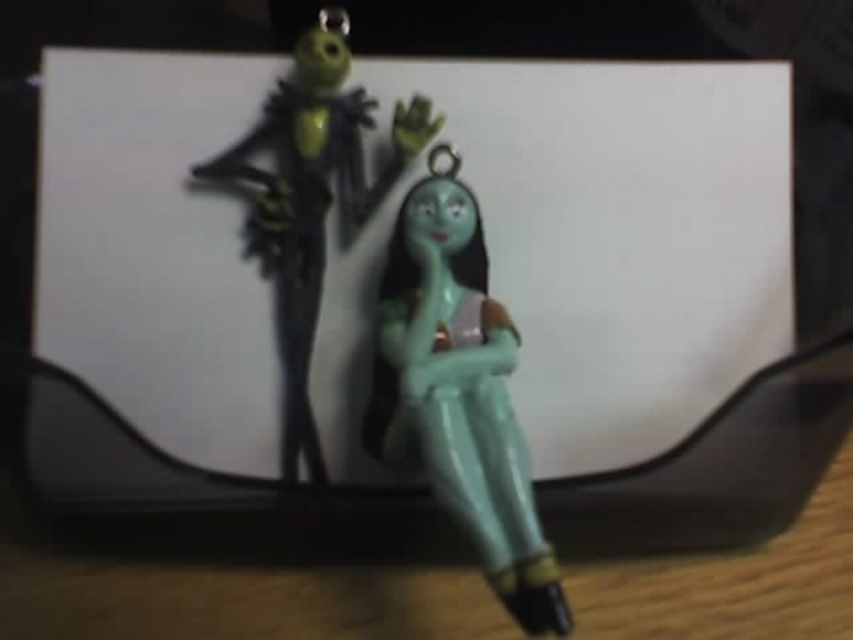
Question: Is teal glossy figure at center positioned in front of matte green figure at center?

Choices:
 (A) no
 (B) yes

Answer: (B)

Question: Among these objects, which one is nearest to the camera?

Choices:
 (A) matte green figure at center
 (B) teal glossy figure at center

Answer: (B)

Question: From the image, what is the correct spatial relationship of teal glossy figure at center in relation to matte green figure at center?

Choices:
 (A) left
 (B) right

Answer: (B)

Question: Does teal glossy figure at center appear on the left side of matte green figure at center?

Choices:
 (A) no
 (B) yes

Answer: (A)